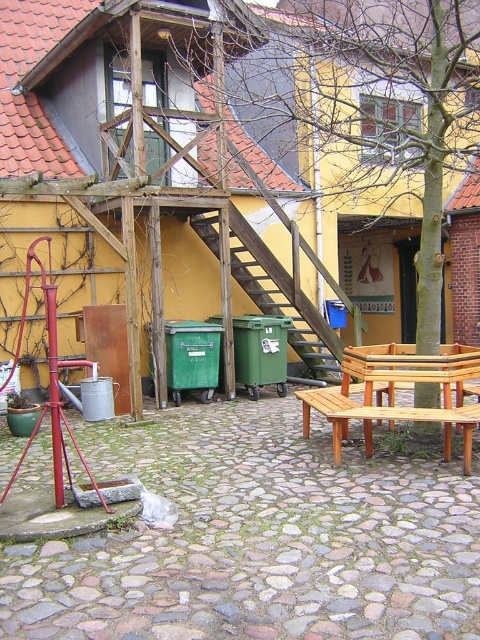
You are a guest at a garden party and want to sit down. You see a light brown wooden picnic table at center and a wooden bench at lower right. Which seating option is closer to you?

The light brown wooden picnic table at center is closer to you because the wooden bench at lower right is behind it.

You are planning to set up a small gathering area in this outdoor space. You have two options for seating arrangements. The first option is placing chairs around the light brown wooden picnic table at center, and the second option is using the wooden bench at lower right. Considering the width of the seating areas, which option would allow for more people to sit comfortably side by side?

The wooden bench at lower right has a greater width than the light brown wooden picnic table at center, so it can accommodate more people sitting side by side comfortably.

You are planning to set up a small gathering area in this outdoor space. You have two options for seating. The light brown wooden picnic table at center and the wooden bench at lower right. Which one can accommodate more people comfortably?

The light brown wooden picnic table at center is bigger than the wooden bench at lower right, so it can accommodate more people comfortably.